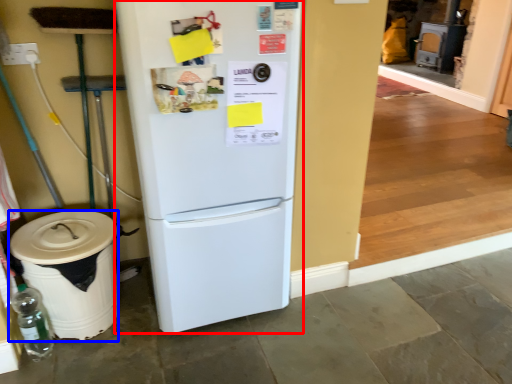
Question: Which object is further to the camera taking this photo, refrigerator (highlighted by a red box) or trash bin/can (highlighted by a blue box)?

Choices:
 (A) refrigerator
 (B) trash bin/can

Answer: (B)